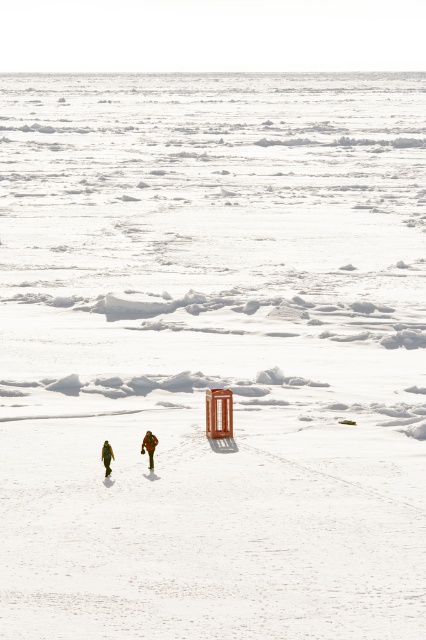
You are a hiker trying to locate your friend in the snowy landscape. You see the orange fabric jacket at center and the green matte jacket at lower center. Which jacket is higher up in the image?

The orange fabric jacket at center is located above the green matte jacket at lower center, so the orange jacket is higher up in the image.

You are a photographer trying to capture both the orange fabric jacket at center and the green matte jacket at lower center in a single shot. Since you want both subjects to be clearly visible, which jacket should you focus on first to ensure depth of field captures both?

The green matte jacket at lower center is behind the orange fabric jacket at center, so you should focus on the orange fabric jacket at center first to ensure the depth of field captures both subjects clearly.